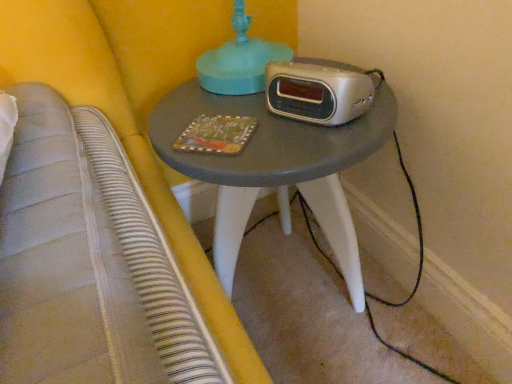
The width and height of the screenshot is (512, 384). Describe the element at coordinates (275, 169) in the screenshot. I see `matte gray table at center` at that location.

What do you see at coordinates (216, 134) in the screenshot?
I see `wooden painted book at center` at bounding box center [216, 134].

Locate an element on the screen. silver metallic alarm clock at center is located at coordinates (317, 93).

From the image's perspective, is silver metallic alarm clock at center above or below matte gray table at center?

From the image's perspective, silver metallic alarm clock at center appears above matte gray table at center.

Looking at the image, does silver metallic alarm clock at center seem bigger or smaller compared to matte gray table at center?

In the image, silver metallic alarm clock at center appears to be smaller than matte gray table at center.

Which is behind, point (281, 103) or point (176, 109)?

The point (176, 109) is more distant.

Which of these two, silver metallic alarm clock at center or matte gray table at center, is wider?

With larger width is matte gray table at center.

Is matte gray table at center taller or shorter than silver metallic alarm clock at center?

In the image, matte gray table at center appears to be taller than silver metallic alarm clock at center.

Are matte gray table at center and silver metallic alarm clock at center far apart?

matte gray table at center is actually quite close to silver metallic alarm clock at center.

From a real-world perspective, which object stands above the other?

In real-world perspective, silver metallic alarm clock at center is above.

Considering the relative sizes of matte gray table at center and silver metallic alarm clock at center in the image provided, is matte gray table at center thinner than silver metallic alarm clock at center?

No.

Is wooden painted book at center oriented away from matte gray table at center?

Yes, wooden painted book at center is positioned with its back facing matte gray table at center.

Is wooden painted book at center inside or outside of matte gray table at center?

wooden painted book at center can be found inside matte gray table at center.

Is wooden painted book at center thinner than matte gray table at center?

Yes, wooden painted book at center is thinner than matte gray table at center.

Between wooden painted book at center and matte gray table at center, which one has less height?

wooden painted book at center.

Could you tell me if silver metallic alarm clock at center is facing wooden painted book at center?

Yes, silver metallic alarm clock at center is turned towards wooden painted book at center.

Is silver metallic alarm clock at center taller or shorter than wooden painted book at center?

silver metallic alarm clock at center is taller than wooden painted book at center.

Between point (290, 72) and point (247, 139), which one is positioned in front?

Point (247, 139)

Is silver metallic alarm clock at center behind wooden painted book at center?

That is False.

From their relative heights in the image, would you say wooden painted book at center is taller or shorter than silver metallic alarm clock at center?

Clearly, wooden painted book at center is shorter compared to silver metallic alarm clock at center.

Looking at this image, what's the angular difference between wooden painted book at center and silver metallic alarm clock at center's facing directions?

110 degrees separate the facing orientations of wooden painted book at center and silver metallic alarm clock at center.

From the image's perspective, is wooden painted book at center above or below silver metallic alarm clock at center?

Based on their image positions, wooden painted book at center is located beneath silver metallic alarm clock at center.

Looking at this image, is silver metallic alarm clock at center at the back of wooden painted book at center?

No, wooden painted book at center is not facing the opposite direction of silver metallic alarm clock at center.

Between matte gray table at center and wooden painted book at center, which one has smaller size?

wooden painted book at center is smaller.

Which object is closer to the camera taking this photo, matte gray table at center or wooden painted book at center?

matte gray table at center is in front.

How different are the orientations of matte gray table at center and wooden painted book at center in degrees?

The angle between the facing direction of matte gray table at center and the facing direction of wooden painted book at center is 49.4 degrees.

From a real-world perspective, which is physically above, matte gray table at center or wooden painted book at center?

In real-world perspective, wooden painted book at center is above.

Where is `stereo above the matte gray table at center (from a real-world perspective)`? stereo above the matte gray table at center (from a real-world perspective) is located at coordinates (317, 93).

Find the location of a particular element. The image size is (512, 384). stereo behind the matte gray table at center is located at coordinates (317, 93).

From the image, which object appears to be farther from matte gray table at center, silver metallic alarm clock at center or wooden painted book at center?

Based on the image, wooden painted book at center appears to be further to matte gray table at center.

Looking at the image, which one is located further to silver metallic alarm clock at center, matte gray table at center or wooden painted book at center?

matte gray table at center is further to silver metallic alarm clock at center.

Based on their spatial positions, is wooden painted book at center or matte gray table at center closer to silver metallic alarm clock at center?

wooden painted book at center is closer to silver metallic alarm clock at center.

Looking at the image, which one is located closer to matte gray table at center, wooden painted book at center or silver metallic alarm clock at center?

silver metallic alarm clock at center is closer to matte gray table at center.

Which object lies further to the anchor point wooden painted book at center, silver metallic alarm clock at center or matte gray table at center?

matte gray table at center.

Considering their positions, is matte gray table at center positioned closer to wooden painted book at center than silver metallic alarm clock at center?

Based on the image, silver metallic alarm clock at center appears to be nearer to wooden painted book at center.

Identify the location of book between silver metallic alarm clock at center and matte gray table at center in the up-down direction. (216, 134).